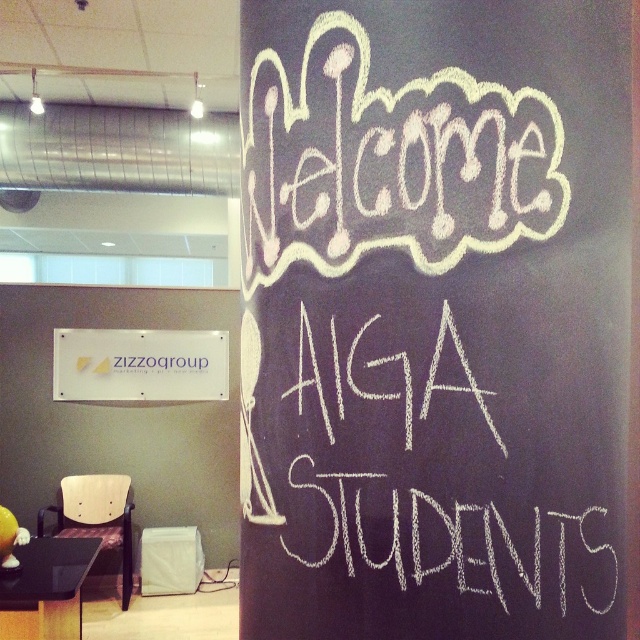
Question: Can you confirm if white chalk writing at center is positioned to the left of white plastic sign at upper left?

Choices:
 (A) yes
 (B) no

Answer: (B)

Question: Which object is farther from the camera taking this photo?

Choices:
 (A) white plastic sign at upper left
 (B) white chalk writing at center
 (C) white chalkboard at upper center

Answer: (A)

Question: Estimate the real-world distances between objects in this image. Which object is closer to the white chalkboard at upper center?

Choices:
 (A) white plastic sign at upper left
 (B) white chalk writing at center

Answer: (B)

Question: Which of the following is the closest to the observer?

Choices:
 (A) white chalkboard at upper center
 (B) white plastic sign at upper left

Answer: (A)

Question: Can you confirm if white chalkboard at upper center is bigger than white plastic sign at upper left?

Choices:
 (A) yes
 (B) no

Answer: (A)

Question: Does white chalkboard at upper center lie behind white chalk writing at center?

Choices:
 (A) yes
 (B) no

Answer: (A)